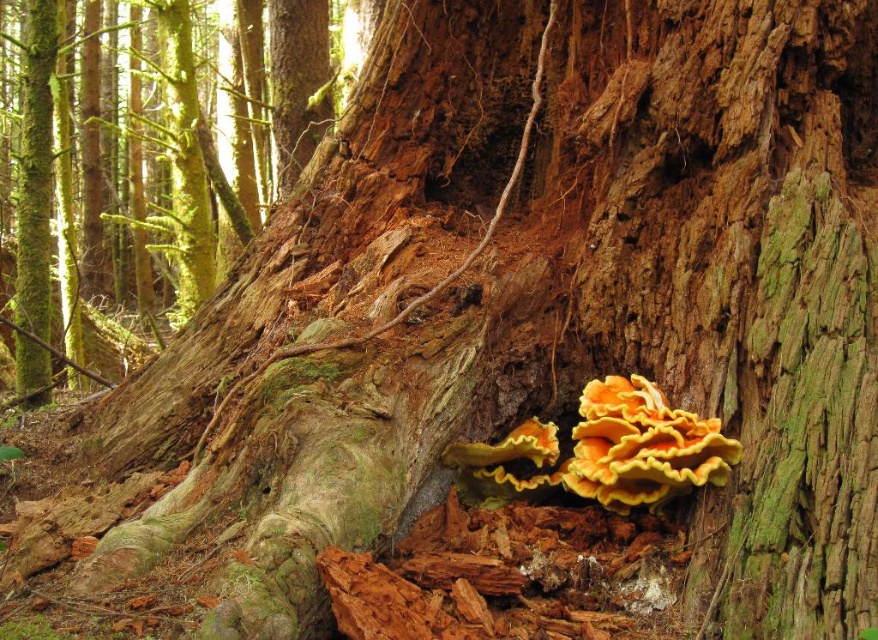
Question: Is orange/yellow polypore at center to the right of smooth bark tree trunk at center from the viewer's perspective?

Choices:
 (A) yes
 (B) no

Answer: (A)

Question: Is orange/yellow polypore at center thinner than smooth bark tree trunk at center?

Choices:
 (A) yes
 (B) no

Answer: (B)

Question: Is orange/yellow polypore at center below smooth bark tree trunk at center?

Choices:
 (A) yes
 (B) no

Answer: (A)

Question: Which point appears closest to the camera in this image?

Choices:
 (A) (632, 470)
 (B) (290, 49)

Answer: (A)